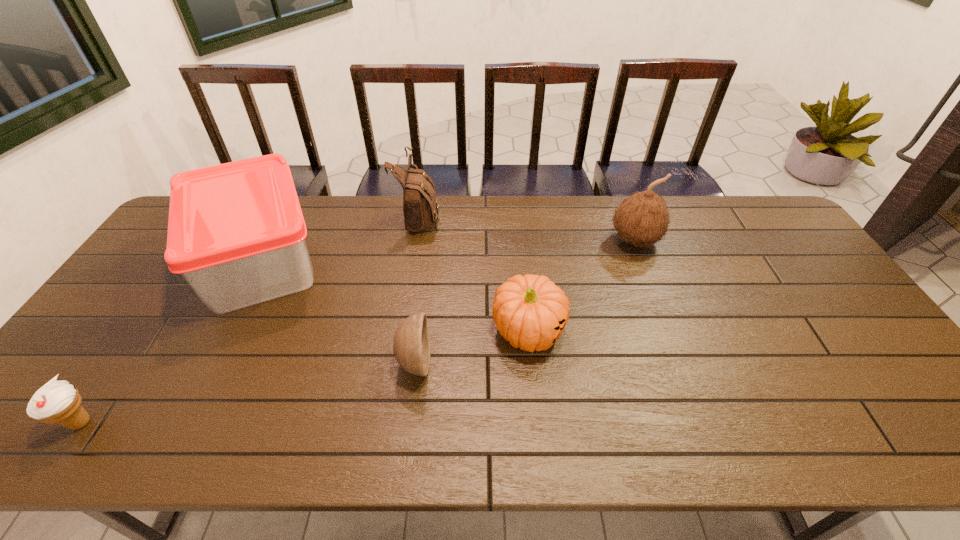
The width and height of the screenshot is (960, 540). Identify the location of vacant space at the far edge of the desktop. (361, 210).

The height and width of the screenshot is (540, 960). What are the coordinates of `free location at the near edge of the desktop` in the screenshot? It's located at (184, 422).

In order to click on free space at the left edge of the desktop in this screenshot , I will do `click(93, 346)`.

Locate an element on the screen. vacant area at the far right corner is located at coordinates (762, 201).

You are a GUI agent. You are given a task and a screenshot of the screen. Output one action in this format:
    pyautogui.click(x=<x>, y=<y>)
    Task: Click on the vacant space that's between the tray and the second object from right to left
    This screenshot has height=540, width=960.
    Given the screenshot: What is the action you would take?
    pyautogui.click(x=395, y=296)

Locate an element on the screen. The width and height of the screenshot is (960, 540). vacant area that lies between the nearest object and the tray is located at coordinates (171, 342).

Locate an element on the screen. vacant space that's between the fifth object from left to right and the bowl is located at coordinates (471, 347).

The image size is (960, 540). I want to click on vacant space in between the coconut and the shoulder bag, so click(527, 228).

Find the location of `free space between the bowl and the shoulder bag`. free space between the bowl and the shoulder bag is located at coordinates (417, 289).

Identify the location of free space between the tray and the nearest object. (171, 342).